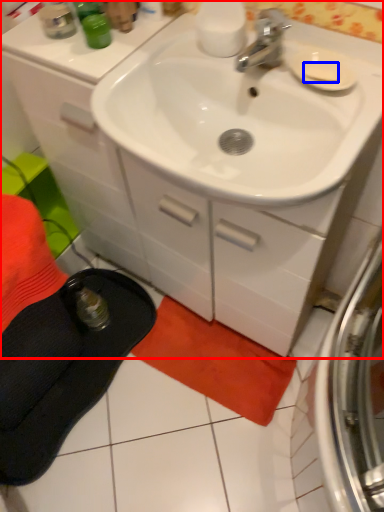
Question: Which of the following is the closest to the observer, bathroom cabinet (highlighted by a red box) or soap (highlighted by a blue box)?

Choices:
 (A) bathroom cabinet
 (B) soap

Answer: (A)